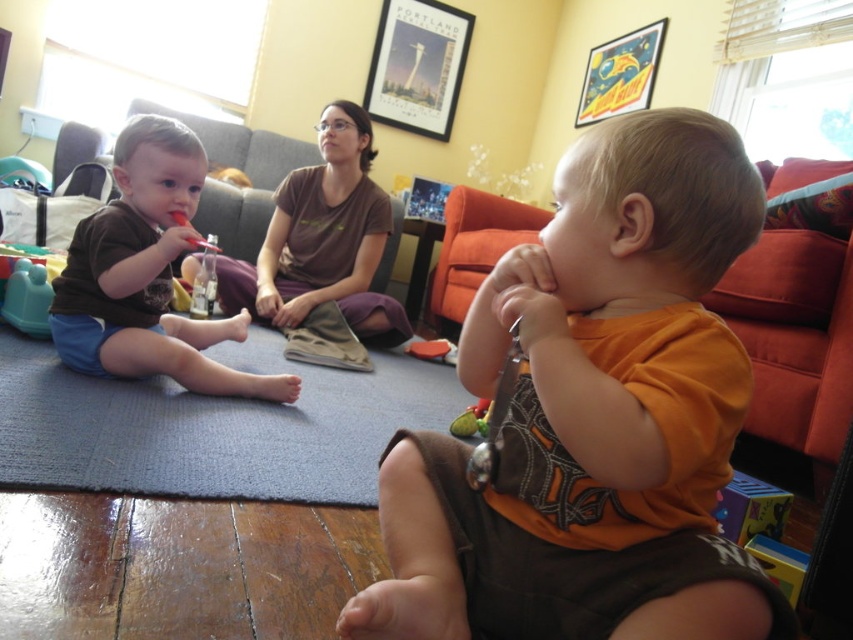
Who is taller, orange cotton shirt at center or metallic gold poster at upper right?

With more height is orange cotton shirt at center.

Is point (601, 195) positioned in front of point (634, 77)?

Yes, it is in front of point (634, 77).

This screenshot has height=640, width=853. I want to click on orange cotton shirt at center, so click(x=592, y=417).

Between brown cotton shirt at center and metallic poster at upper center, which one is positioned lower?

brown cotton shirt at center is lower down.

Is point (287, 284) closer to viewer compared to point (408, 45)?

Yes, it is.

Where is `brown cotton shirt at center`? brown cotton shirt at center is located at coordinates (323, 241).

Who is more forward, (187, 436) or (224, 332)?

Point (187, 436) is in front.

Can you confirm if blue carpet at lower left is positioned to the right of matte brown shorts at left?

Correct, you'll find blue carpet at lower left to the right of matte brown shorts at left.

The height and width of the screenshot is (640, 853). In order to click on blue carpet at lower left in this screenshot , I will do `click(212, 426)`.